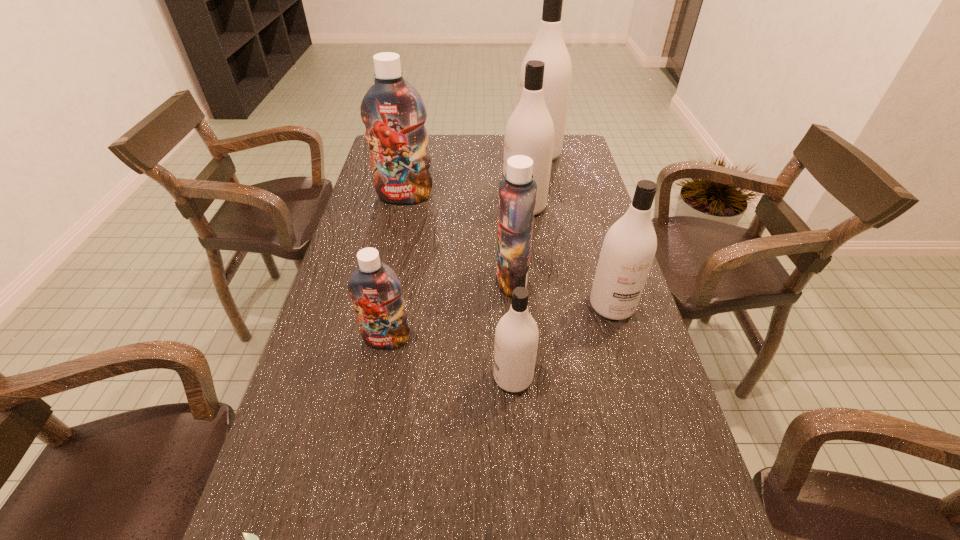
Locate an element on the screen. the farthest shampoo is located at coordinates pos(549,47).

Identify the location of the farthest white shampoo. The image size is (960, 540). (549, 47).

Locate an element on the screen. The image size is (960, 540). the second biggest white shampoo is located at coordinates (529, 131).

Image resolution: width=960 pixels, height=540 pixels. Identify the location of the farthest blue shampoo. (392, 110).

At what (x,y) coordinates should I click in order to perform the action: click on the rightmost blue shampoo. Please return your answer as a coordinate pair (x, y). The image size is (960, 540). Looking at the image, I should click on (517, 192).

Find the location of a particular element. the second nearest blue shampoo is located at coordinates (517, 192).

What are the coordinates of `the second smallest white shampoo` in the screenshot? It's located at (628, 250).

In order to click on the nearest white shampoo in this screenshot , I will do `click(516, 335)`.

The width and height of the screenshot is (960, 540). I want to click on the smallest white shampoo, so click(x=516, y=335).

This screenshot has width=960, height=540. I want to click on the second nearest shampoo, so click(374, 287).